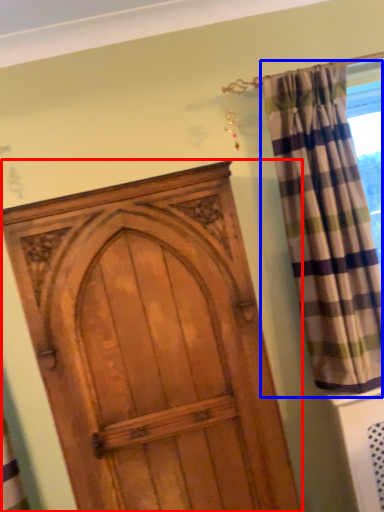
Question: Which object appears closest to the camera in this image, door (highlighted by a red box) or curtain (highlighted by a blue box)?

Choices:
 (A) door
 (B) curtain

Answer: (A)